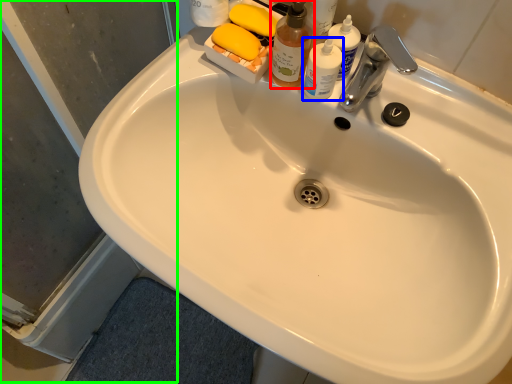
Question: Estimate the real-world distances between objects in this image. Which object is farther from cleaning product (highlighted by a red box), toiletry (highlighted by a blue box) or screen door (highlighted by a green box)?

Choices:
 (A) toiletry
 (B) screen door

Answer: (B)